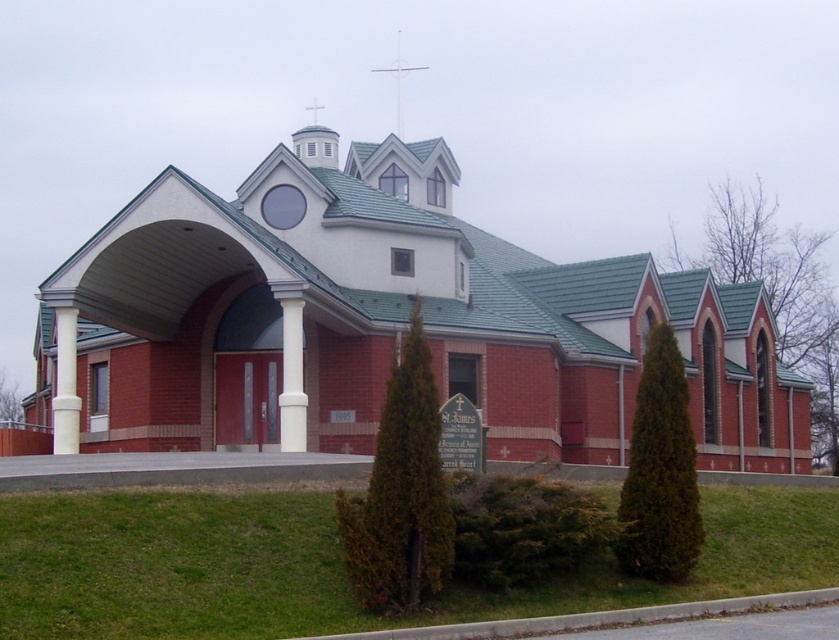
Question: Is red brick chapel at center to the left of white metal cross at upper center from the viewer's perspective?

Choices:
 (A) no
 (B) yes

Answer: (A)

Question: Which of the following is the closest to the observer?

Choices:
 (A) (283, 396)
 (B) (60, 336)
 (C) (290, 176)
 (D) (395, 104)

Answer: (A)

Question: Is red brick chapel at center positioned at the back of white smooth column at center?

Choices:
 (A) no
 (B) yes

Answer: (A)

Question: Considering the real-world distances, which object is farthest from the red brick chapel at center?

Choices:
 (A) white metal cross at upper center
 (B) white smooth column at left
 (C) white smooth column at center

Answer: (A)

Question: From the image, what is the correct spatial relationship of white smooth column at center in relation to white metal cross at upper center?

Choices:
 (A) left
 (B) right

Answer: (B)

Question: Which object appears closest to the camera in this image?

Choices:
 (A) red brick chapel at center
 (B) white smooth column at center
 (C) white smooth column at left

Answer: (A)